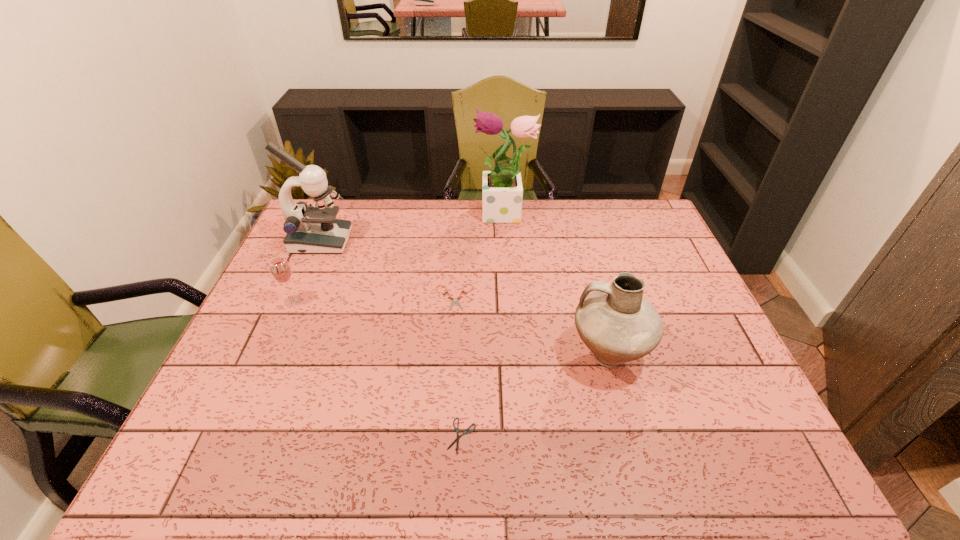
Find the location of `object that is the fourth closest to the fifth tallest object`. object that is the fourth closest to the fifth tallest object is located at coordinates (310, 229).